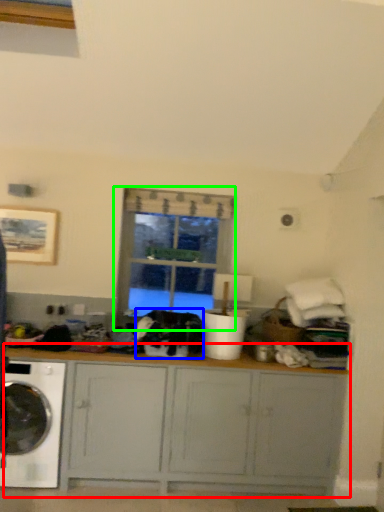
Question: Based on their relative distances, which object is nearer to cabinetry (highlighted by a red box)? Choose from clothing (highlighted by a blue box) and window (highlighted by a green box).

Choices:
 (A) clothing
 (B) window

Answer: (A)